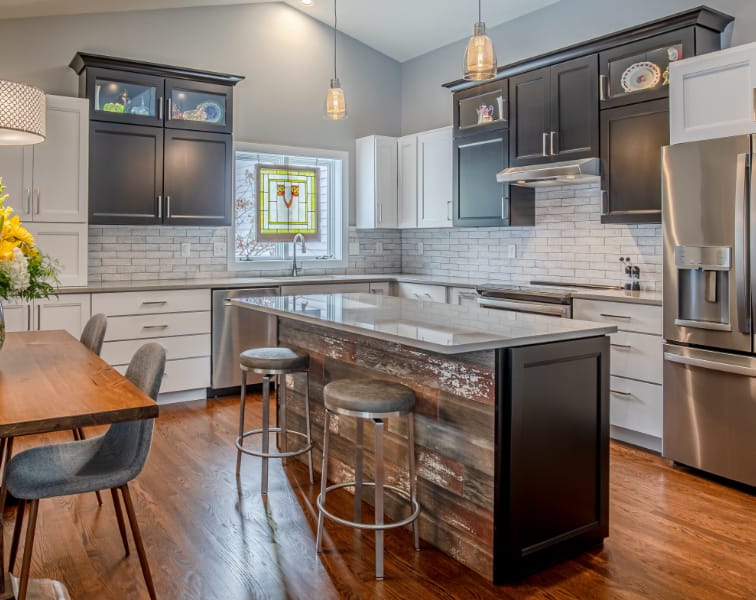
Identify the location of place to sit. This screenshot has height=600, width=756. (115, 466), (259, 361), (355, 392), (94, 335).